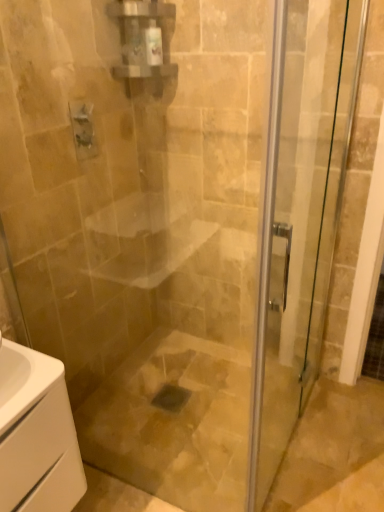
Question: Is transparent glass door at center positioned in front of white glossy cabinet at lower left?

Choices:
 (A) yes
 (B) no

Answer: (A)

Question: Could white glossy cabinet at lower left be considered to be inside transparent glass door at center?

Choices:
 (A) yes
 (B) no

Answer: (B)

Question: From the image's perspective, is transparent glass door at center below white glossy cabinet at lower left?

Choices:
 (A) no
 (B) yes

Answer: (A)

Question: From a real-world perspective, is transparent glass door at center located beneath white glossy cabinet at lower left?

Choices:
 (A) yes
 (B) no

Answer: (B)

Question: Is transparent glass door at center positioned with its back to white glossy cabinet at lower left?

Choices:
 (A) yes
 (B) no

Answer: (B)

Question: Is transparent glass door at center wider or thinner than matte silver faucet at upper left?

Choices:
 (A) wide
 (B) thin

Answer: (A)

Question: Is transparent glass door at center taller or shorter than matte silver faucet at upper left?

Choices:
 (A) tall
 (B) short

Answer: (A)

Question: From the image's perspective, is transparent glass door at center above or below matte silver faucet at upper left?

Choices:
 (A) below
 (B) above

Answer: (A)

Question: Visually, is transparent glass door at center positioned to the left or to the right of matte silver faucet at upper left?

Choices:
 (A) left
 (B) right

Answer: (B)

Question: Does point (67, 406) appear closer or farther from the camera than point (86, 116)?

Choices:
 (A) closer
 (B) farther

Answer: (A)

Question: Do you think white glossy cabinet at lower left is within matte silver faucet at upper left, or outside of it?

Choices:
 (A) outside
 (B) inside

Answer: (A)

Question: From their relative heights in the image, would you say white glossy cabinet at lower left is taller or shorter than matte silver faucet at upper left?

Choices:
 (A) tall
 (B) short

Answer: (A)

Question: Would you say white glossy cabinet at lower left is to the left or to the right of matte silver faucet at upper left in the picture?

Choices:
 (A) left
 (B) right

Answer: (A)

Question: Based on their sizes in the image, would you say white glossy cabinet at lower left is bigger or smaller than transparent glass door at center?

Choices:
 (A) small
 (B) big

Answer: (A)

Question: From a real-world perspective, is white glossy cabinet at lower left positioned above or below transparent glass door at center?

Choices:
 (A) below
 (B) above

Answer: (A)